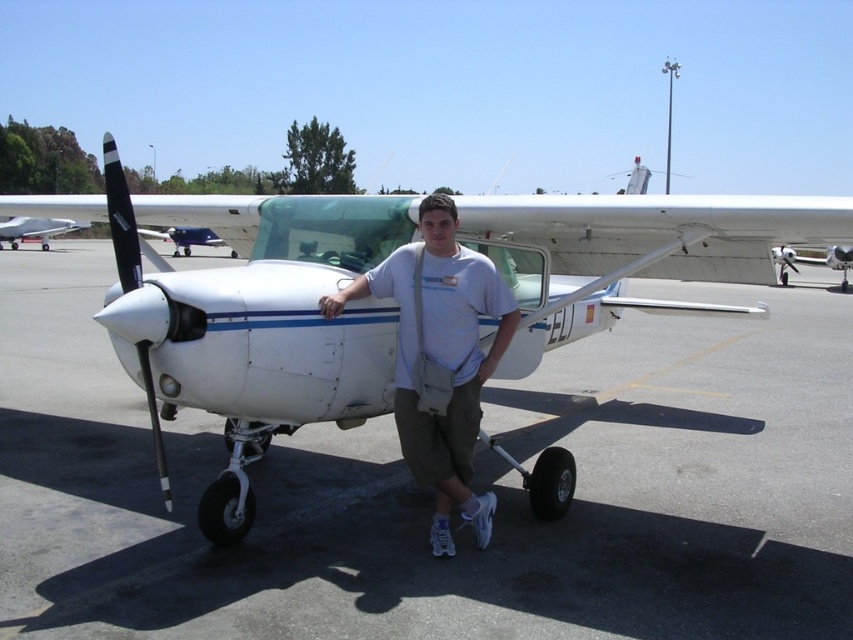
You are standing at point (189,252) and want to walk to the aircraft. Is the point (418,330) between you and the aircraft?

Yes, point (418,330) is between you and the aircraft because point (418,330) is in front of point (189,252).

Based on the scene description, what are the coordinates of the white matte airplane at center?

The white matte airplane at center is located at coordinates (250, 321).